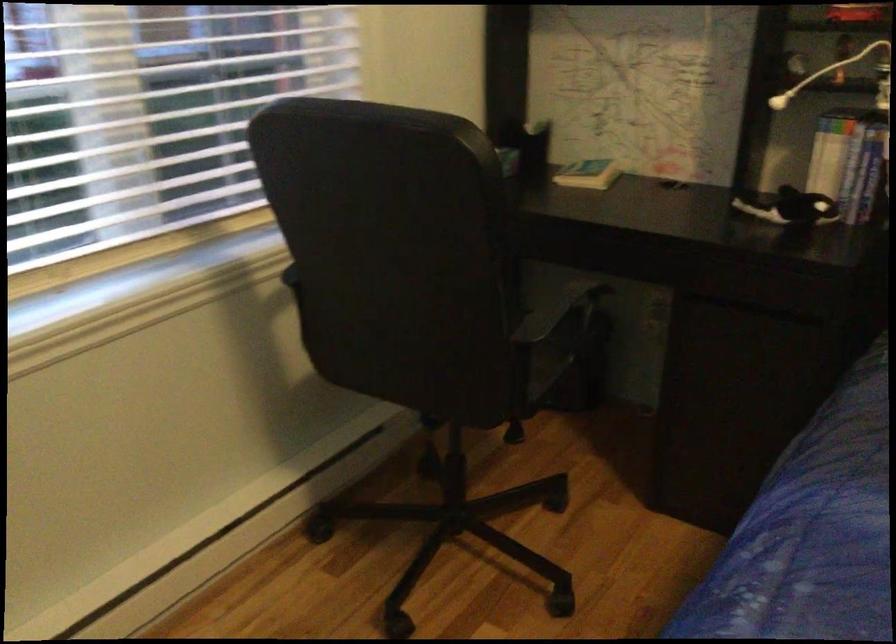
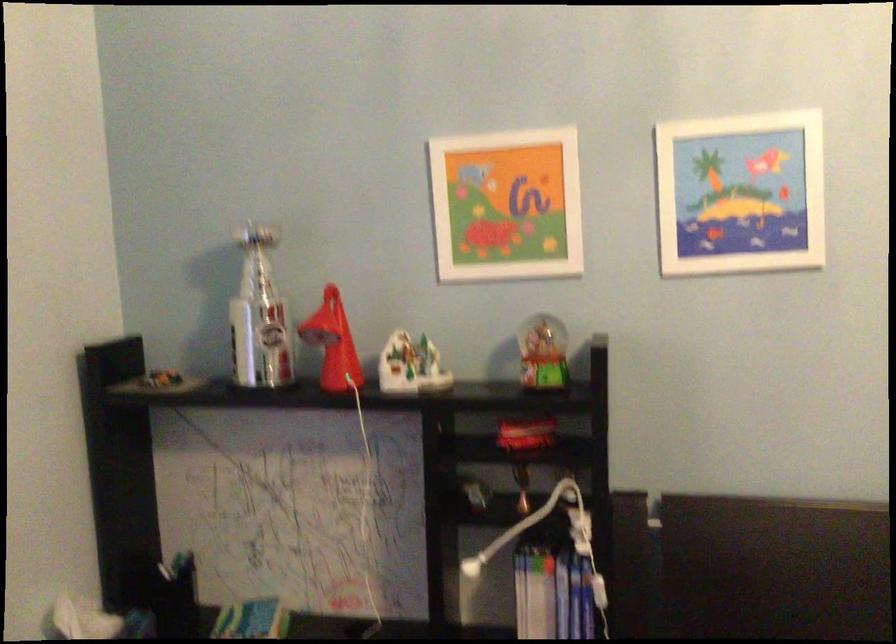
Question: The camera is either moving clockwise (left) or counter-clockwise (right) around the object. The first image is from the beginning of the video and the second image is from the end. Is the camera moving left or right when shooting the video?

Choices:
 (A) Left
 (B) Right

Answer: (A)